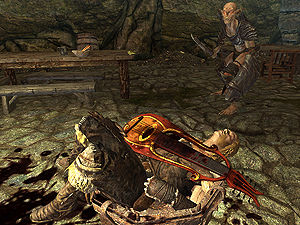
This screenshot has height=225, width=300. Find the location of `bench`. bench is located at coordinates (81, 89).